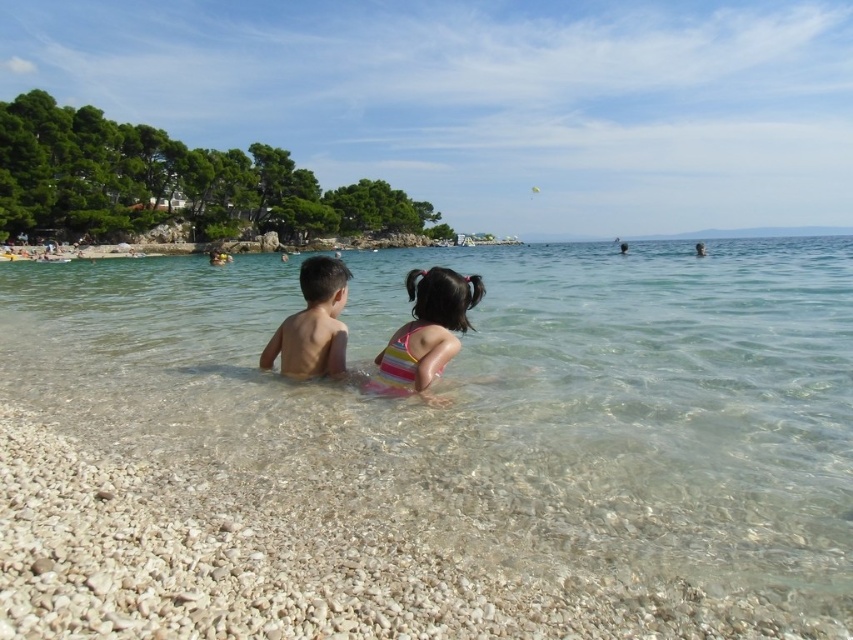
Question: Can you confirm if clear water at center is smaller than striped swimsuit at center?

Choices:
 (A) yes
 (B) no

Answer: (B)

Question: Among these objects, which one is farthest from the camera?

Choices:
 (A) striped swimsuit at center
 (B) clear water at center
 (C) naked skin boy at center

Answer: (C)

Question: Considering the relative positions of clear water at center and striped swimsuit at center in the image provided, where is clear water at center located with respect to striped swimsuit at center?

Choices:
 (A) left
 (B) right

Answer: (B)

Question: Among these points, which one is nearest to the camera?

Choices:
 (A) (437, 544)
 (B) (287, 323)

Answer: (A)

Question: Can you confirm if clear water at center is positioned above striped swimsuit at center?

Choices:
 (A) yes
 (B) no

Answer: (A)

Question: Which point is closer to the camera taking this photo?

Choices:
 (A) (271, 337)
 (B) (154, 401)

Answer: (B)